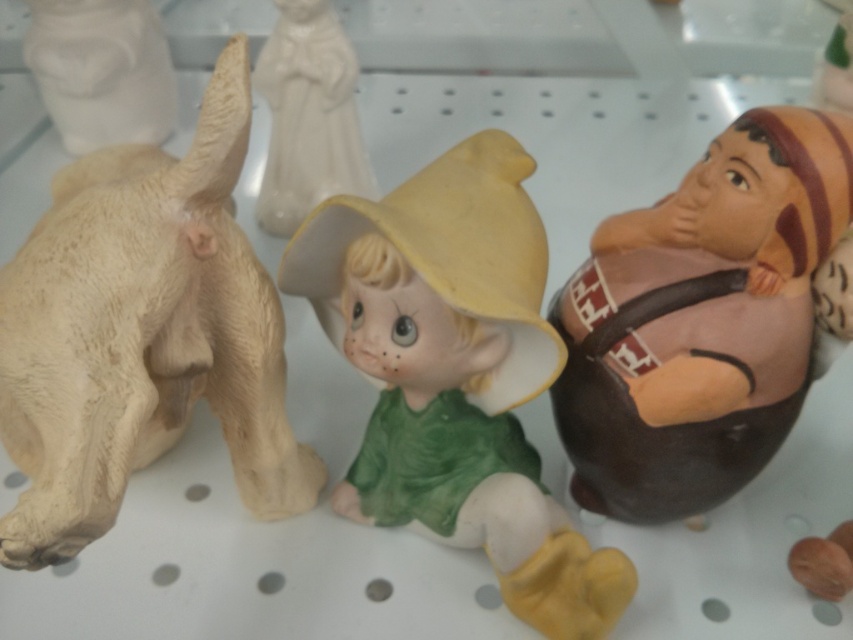
Based on the provided coordinates, where is the brown matte figure at right located in the image?

The brown matte figure at right is located at the coordinates point (701, 321).

Based on the photo, you are an interior designer arranging items on a shelf. You have a brown matte figure at right and a white matte statue at upper center. Which object should you place closer to the edge of the shelf to ensure stability?

The brown matte figure at right should be placed closer to the edge of the shelf because it might be wider than the white matte statue at upper center, providing a more stable base.